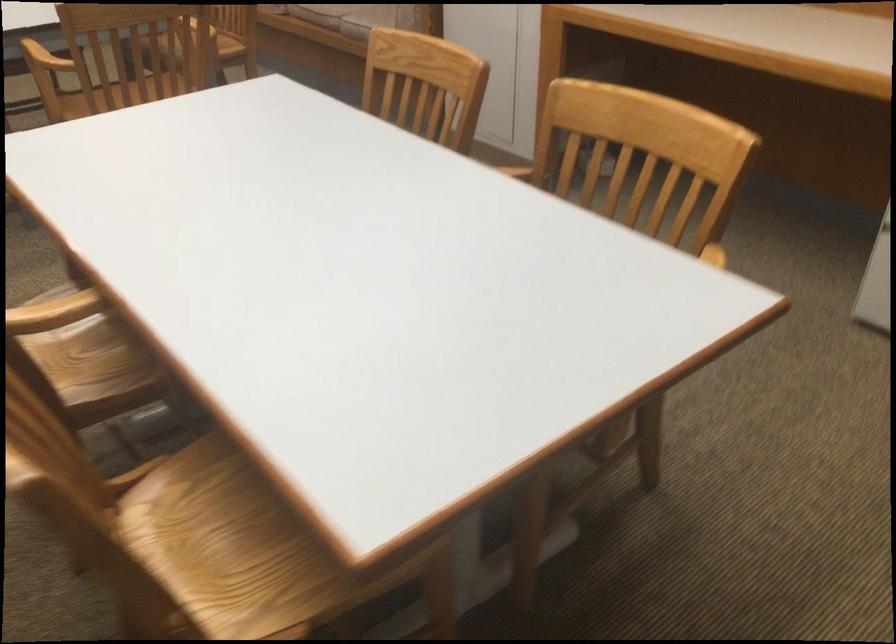
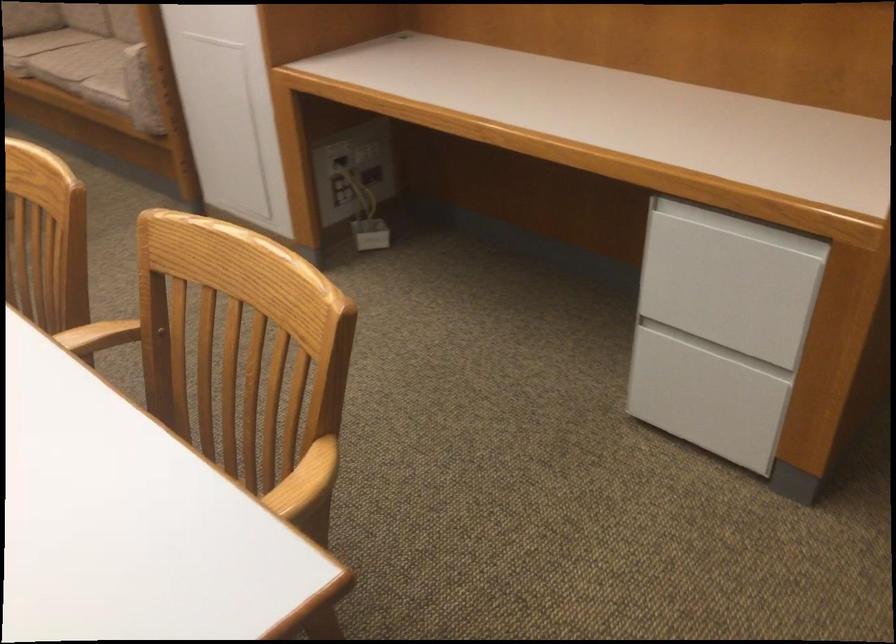
In the second image, find the point that corresponds to (702,261) in the first image.

(304, 482)